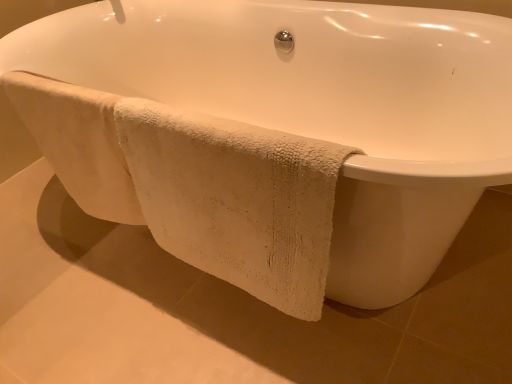
The width and height of the screenshot is (512, 384). What do you see at coordinates (236, 199) in the screenshot?
I see `beige textured towel at lower left` at bounding box center [236, 199].

What is the approximate width of beige textured towel at lower left?

beige textured towel at lower left is 2.08 inches in width.

Image resolution: width=512 pixels, height=384 pixels. I want to click on beige textured towel at lower left, so click(236, 199).

Image resolution: width=512 pixels, height=384 pixels. What are the coordinates of `beige textured towel at lower left` in the screenshot? It's located at (236, 199).